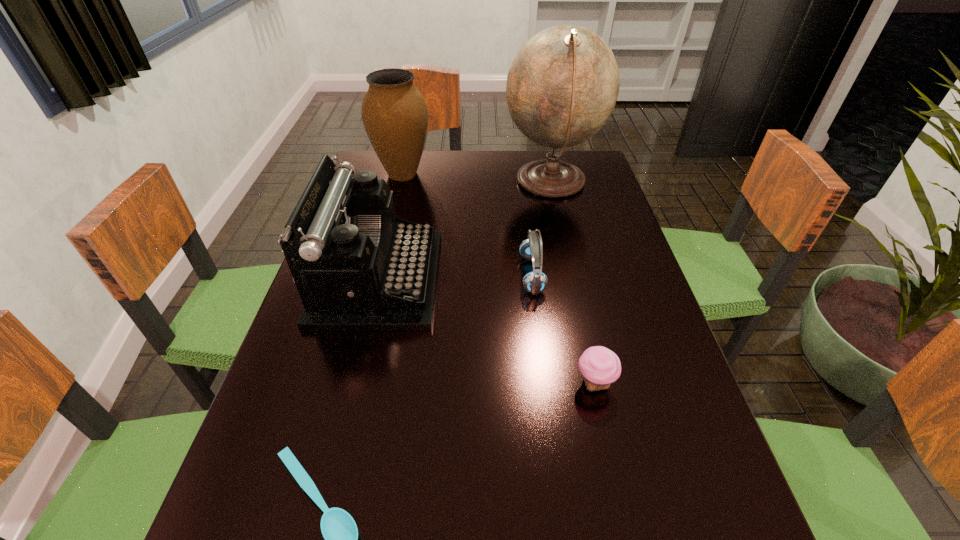
The image size is (960, 540). What are the coordinates of `cupcake present at the right edge` in the screenshot? It's located at (600, 367).

The width and height of the screenshot is (960, 540). In order to click on object present at the far left corner in this screenshot , I will do `click(394, 113)`.

Identify the location of object present at the far right corner. This screenshot has height=540, width=960. (562, 86).

At what (x,y) coordinates should I click in order to perform the action: click on vacant space at the far edge. Please return your answer as a coordinate pair (x, y). This screenshot has width=960, height=540. Looking at the image, I should click on (475, 170).

I want to click on free space at the left edge of the desktop, so click(343, 454).

Identify the location of vacant point at the right edge. (574, 240).

Where is `free space between the third shortest object and the fifth tallest object`? free space between the third shortest object and the fifth tallest object is located at coordinates (564, 329).

Identify the location of empty space that is in between the fourth tallest object and the typewriter. Image resolution: width=960 pixels, height=540 pixels. (455, 277).

This screenshot has width=960, height=540. I want to click on vacant space in between the third shortest object and the typewriter, so click(455, 277).

At what (x,y) coordinates should I click in order to perform the action: click on free spot between the second tallest object and the globe. Please return your answer as a coordinate pair (x, y). Looking at the image, I should click on (477, 178).